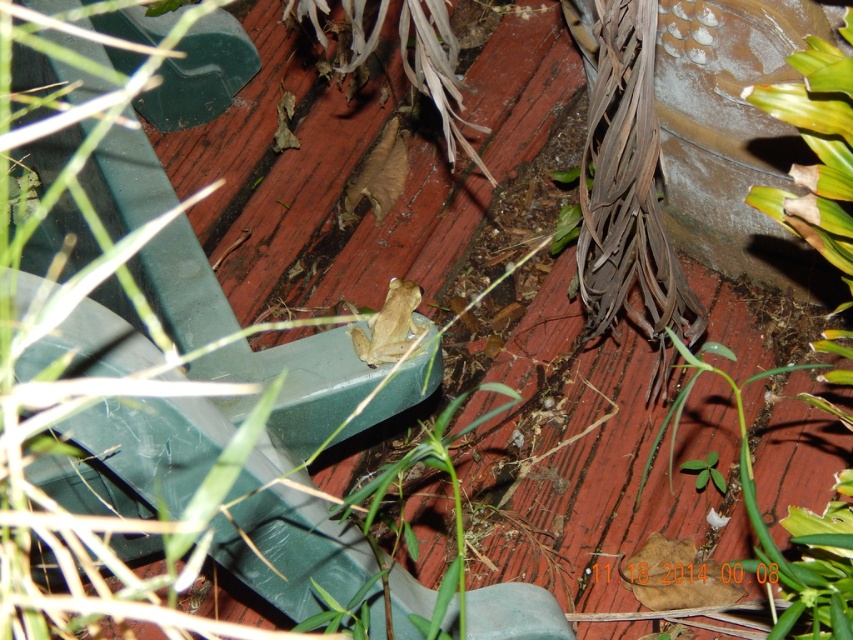
Question: Among these points, which one is farthest from the camera?

Choices:
 (A) (387, 288)
 (B) (846, 611)

Answer: (A)

Question: Which of the following is the farthest from the observer?

Choices:
 (A) green leafy plant at lower right
 (B) smooth beige frog at center

Answer: (B)

Question: Is green leafy plant at lower right to the right of smooth beige frog at center from the viewer's perspective?

Choices:
 (A) yes
 (B) no

Answer: (A)

Question: Is green leafy plant at lower right closer to the viewer compared to smooth beige frog at center?

Choices:
 (A) no
 (B) yes

Answer: (B)

Question: Which of the following is the farthest from the observer?

Choices:
 (A) smooth beige frog at center
 (B) green leafy plant at lower right

Answer: (A)

Question: Can you confirm if green leafy plant at lower right is positioned above smooth beige frog at center?

Choices:
 (A) yes
 (B) no

Answer: (B)